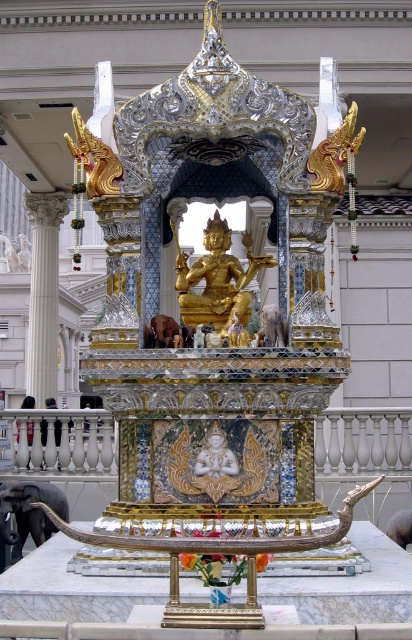
What is located at the point with coordinates (x=217, y=282) in the image?

The gold polished statue at center is located at the point with coordinates (x=217, y=282).

You are standing in front of the golden statue and want to take a photo. You notice two points marked on the structure at coordinates point (205, 289) and point (41, 356). Which point will appear larger in your photo?

Point (205, 289) is closer to the camera than point (41, 356), so it will appear larger in the photo.

You are standing in front of the structure housing the gold polished statue at center and the white marble column at left. If you want to move from the column to the statue, which direction should you move?

You should move to the right to reach the gold polished statue at center from the white marble column at left because the gold polished statue at center is located to the right of the white marble column at left.